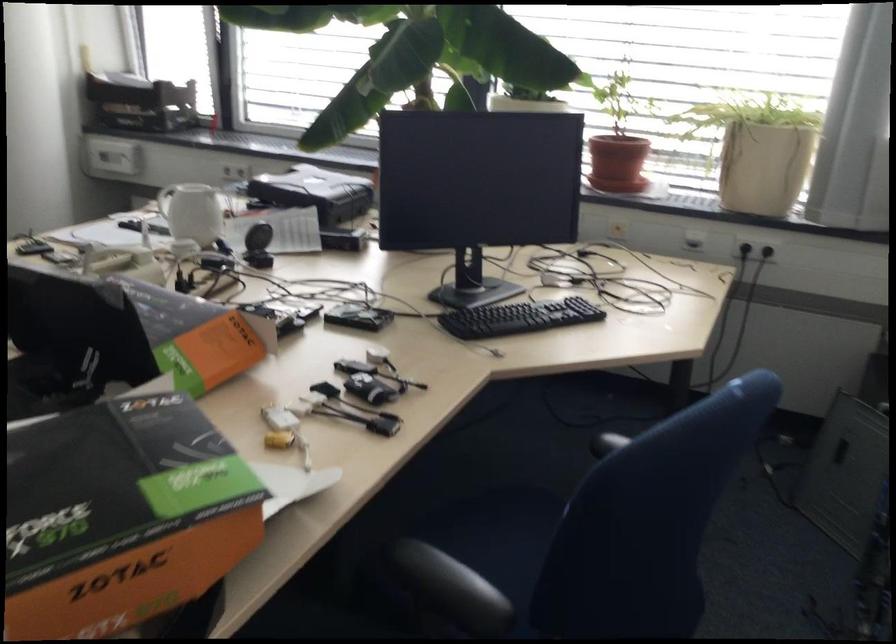
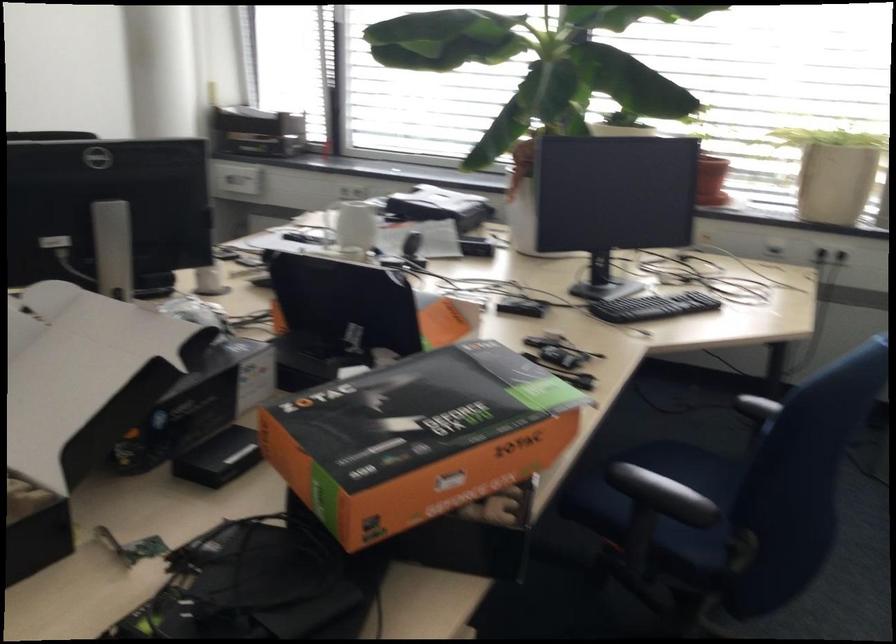
Where in the second image is the point corresponding to (x=479, y=554) from the first image?

(659, 484)